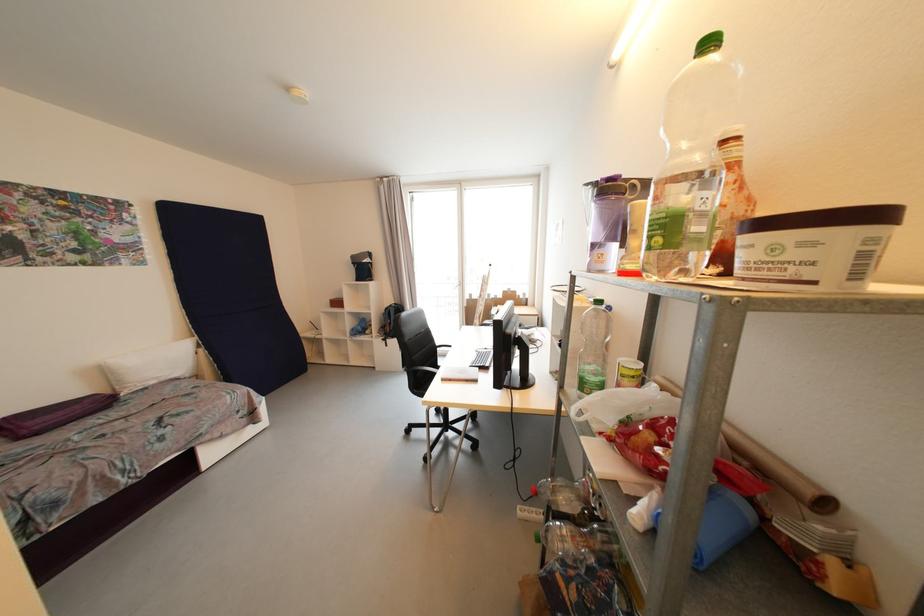
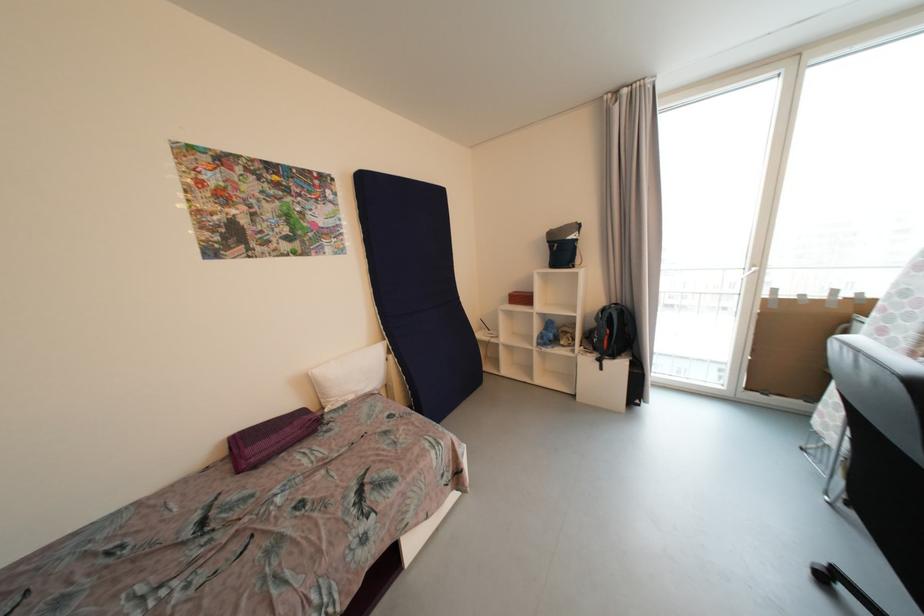
In the second image, find the point that corresponds to (x=358, y=331) in the first image.

(545, 339)